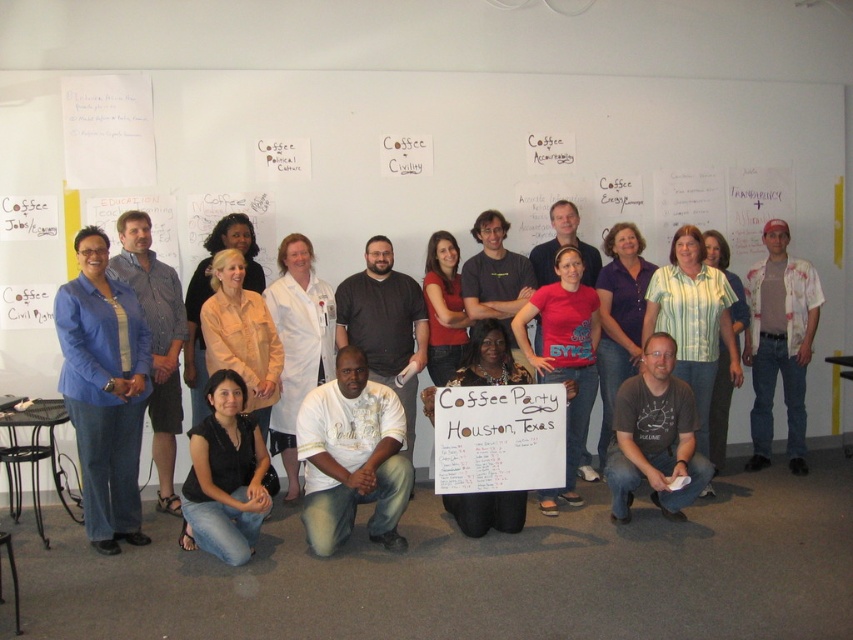
Can you confirm if blue fabric shirt at left is bigger than white painted shirt at right?

Incorrect, blue fabric shirt at left is not larger than white painted shirt at right.

Where is `blue fabric shirt at left`? The width and height of the screenshot is (853, 640). blue fabric shirt at left is located at coordinates (103, 390).

Measure the distance between blue fabric shirt at left and black denim jeans at lower left.

They are 42.59 centimeters apart.

Does blue fabric shirt at left appear under black denim jeans at lower left?

No, blue fabric shirt at left is not below black denim jeans at lower left.

Does point (148, 344) lie in front of point (256, 442)?

Yes, it is.

This screenshot has width=853, height=640. I want to click on blue fabric shirt at left, so click(x=103, y=390).

Is point (305, 248) closer to viewer compared to point (120, 268)?

No, it is behind (120, 268).

Who is positioned more to the left, white lab coat at center or blue striped shirt at left?

blue striped shirt at left is more to the left.

Is point (297, 307) farther from camera compared to point (163, 275)?

Yes, it is.

Identify the location of white lab coat at center. (299, 344).